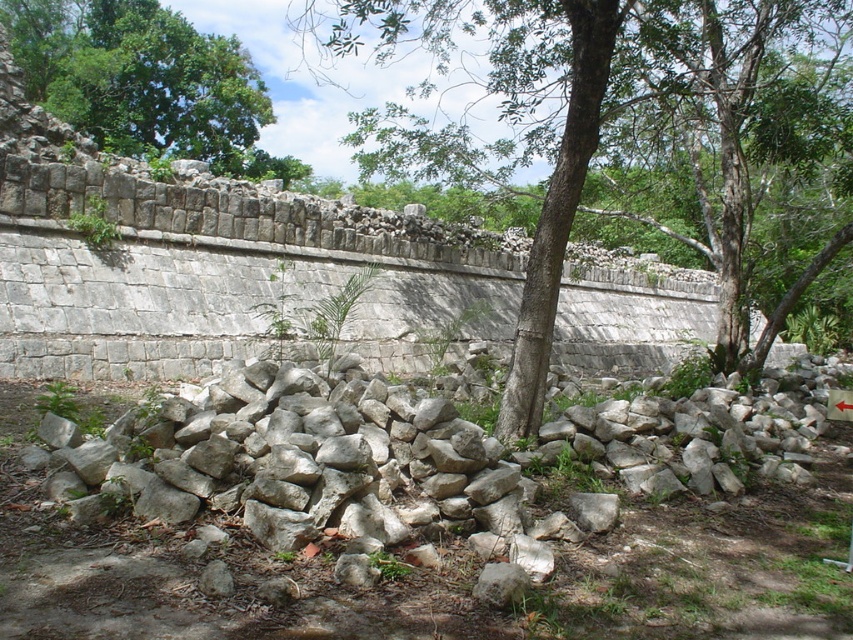
Looking at this image, you are standing at the base of the ancient stone wall and notice two points marked on the ground. The first point is labeled as point (357, 36), and the second is point (199, 36). Which of these points is closer to you?

Point (199, 36) is closer to you because it is in front of point (357, 36).

Looking at this image, you are a hiker who wants to take a photo of the ancient stone wall. You notice the green rough bark tree at center and the green leafy tree at upper left. Which tree is blocking your view of the wall?

The green leafy tree at upper left is blocking the view because the green rough bark tree at center is positioned under it, meaning the upper tree is in front.

You are an archaeologist examining the ancient stone wall. You notice the white rough stones at center and the green leafy tree at upper left. Which object is closer to the ground?

The white rough stones at center are closer to the ground because they are at the center, while the green leafy tree at upper left is positioned higher up.